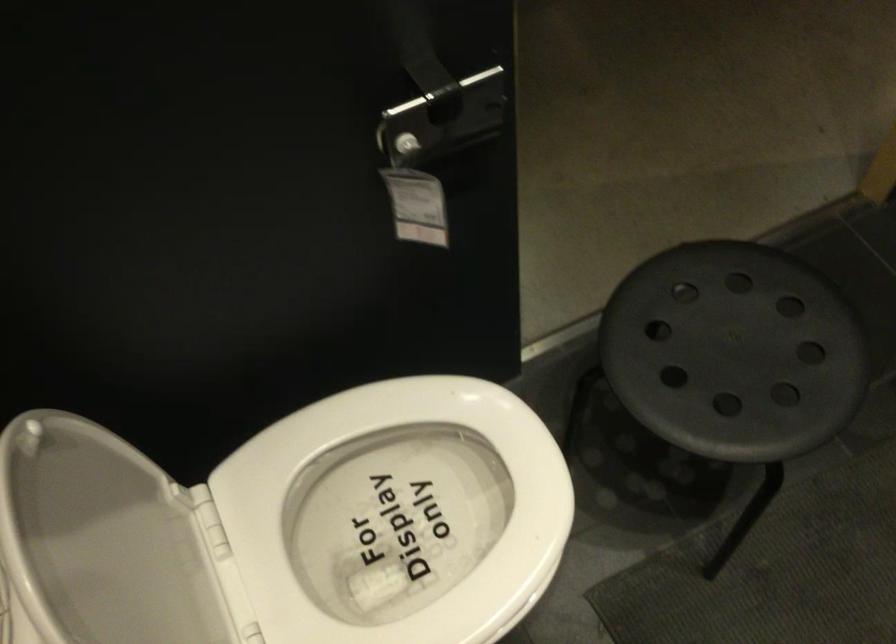
The image size is (896, 644). What do you see at coordinates (397, 515) in the screenshot? I see `a white toilet seat` at bounding box center [397, 515].